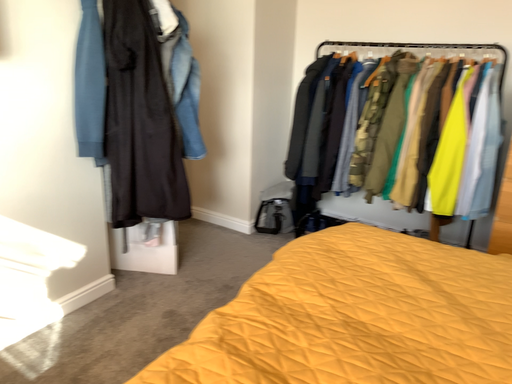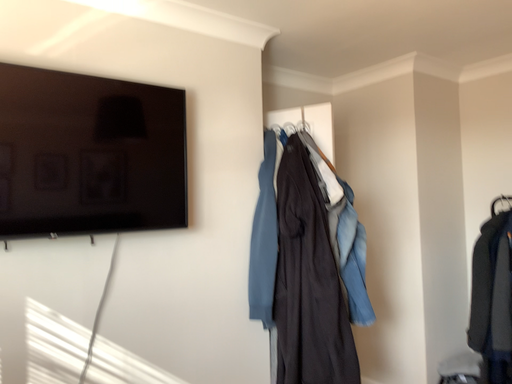
Question: How did the camera likely rotate when shooting the video?

Choices:
 (A) rotated downward
 (B) rotated upward

Answer: (B)